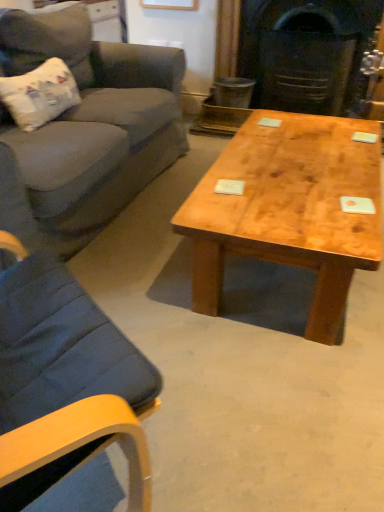
Question: Is natural wood coffee table at center outside white paper-like pillow at left?

Choices:
 (A) no
 (B) yes

Answer: (B)

Question: Is natural wood coffee table at center facing away from white paper-like pillow at left?

Choices:
 (A) yes
 (B) no

Answer: (A)

Question: Does natural wood coffee table at center have a lesser height compared to white paper-like pillow at left?

Choices:
 (A) yes
 (B) no

Answer: (A)

Question: Could you tell me if natural wood coffee table at center is turned towards white paper-like pillow at left?

Choices:
 (A) no
 (B) yes

Answer: (A)

Question: Can white paper-like pillow at left be found inside natural wood coffee table at center?

Choices:
 (A) no
 (B) yes

Answer: (A)

Question: From the image's perspective, is natural wood coffee table at center located above white paper-like pillow at left?

Choices:
 (A) yes
 (B) no

Answer: (B)

Question: Is dark gray stone fireplace at center taller than white paper-like pillow at left?

Choices:
 (A) yes
 (B) no

Answer: (A)

Question: Does dark gray stone fireplace at center appear on the right side of white paper-like pillow at left?

Choices:
 (A) no
 (B) yes

Answer: (B)

Question: From the image's perspective, is dark gray stone fireplace at center under white paper-like pillow at left?

Choices:
 (A) yes
 (B) no

Answer: (B)

Question: From the image's perspective, would you say dark gray stone fireplace at center is positioned over white paper-like pillow at left?

Choices:
 (A) no
 (B) yes

Answer: (B)

Question: Is dark gray stone fireplace at center touching white paper-like pillow at left?

Choices:
 (A) yes
 (B) no

Answer: (B)

Question: Can white paper-like pillow at left be found inside dark gray stone fireplace at center?

Choices:
 (A) no
 (B) yes

Answer: (A)

Question: Does white paper-like pillow at left have a greater width compared to natural wood coffee table at center?

Choices:
 (A) yes
 (B) no

Answer: (B)